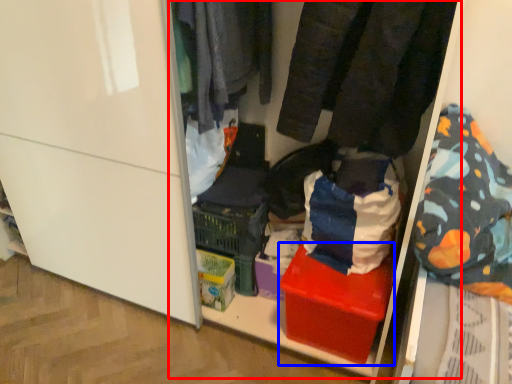
Question: Which of the following is the farthest to the observer, shelf (highlighted by a red box) or box (highlighted by a blue box)?

Choices:
 (A) shelf
 (B) box

Answer: (B)